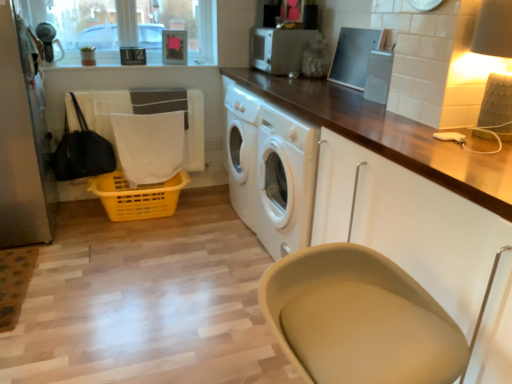
Locate an element on the screen. The image size is (512, 384). free location to the right of yellow plastic basket at lower left is located at coordinates (200, 228).